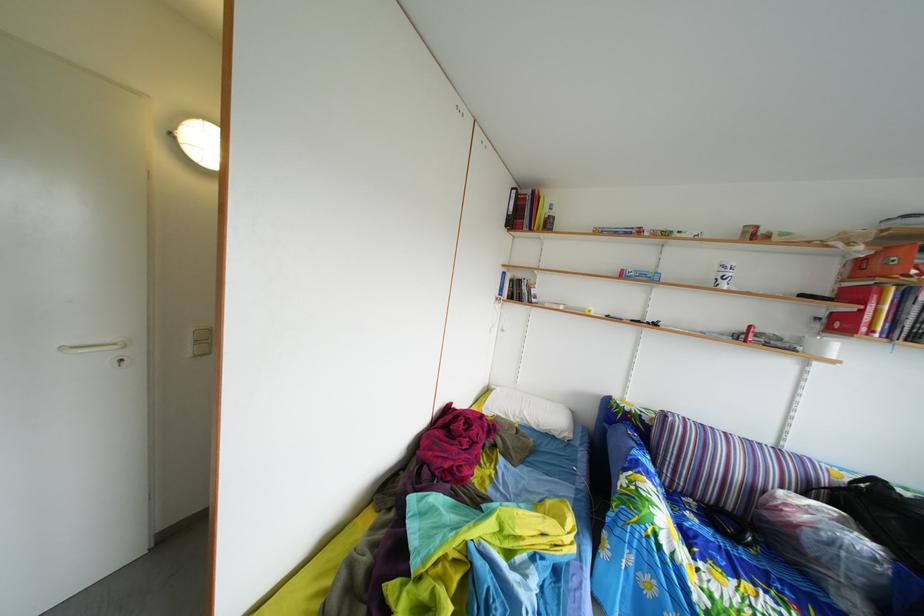
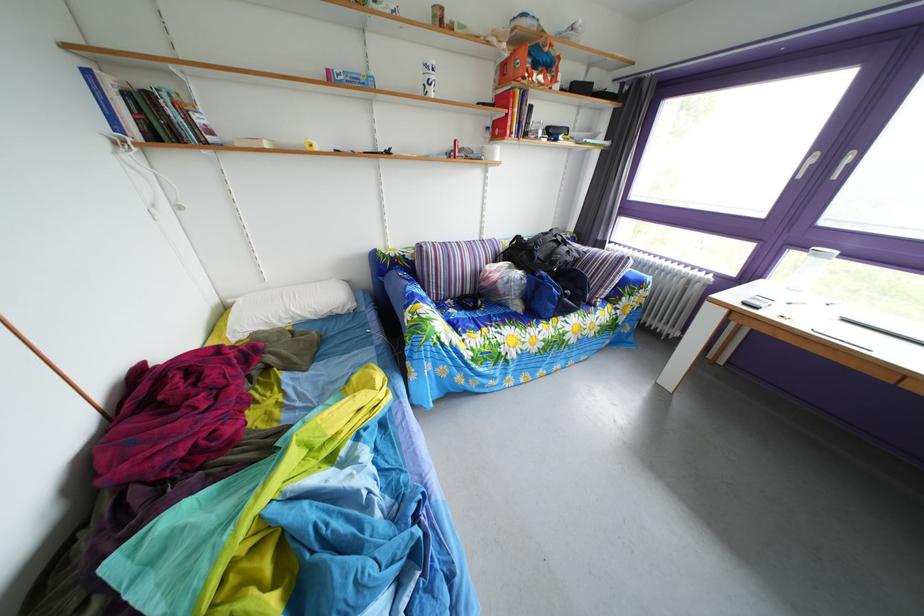
Find the pixel in the second image that matches pixel 633 278 in the first image.

(339, 79)